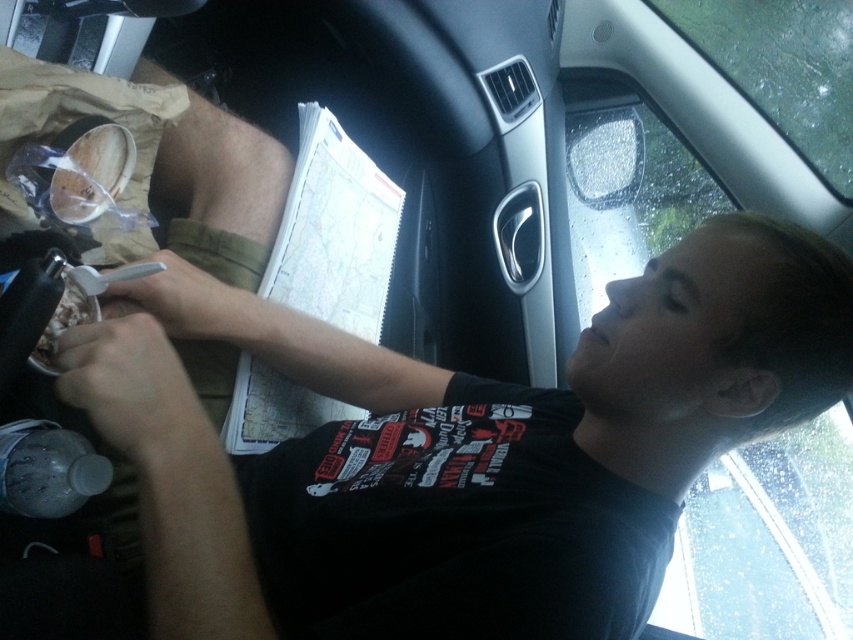
Locate an element on the screen. The image size is (853, 640). transparent glass car window at upper right is located at coordinates (769, 540).

What do you see at coordinates (769, 540) in the screenshot? I see `transparent glass car window at upper right` at bounding box center [769, 540].

Find the location of a particular element. transparent glass car window at upper right is located at coordinates (769, 540).

Where is `transparent glass car window at upper right`? The image size is (853, 640). transparent glass car window at upper right is located at coordinates (769, 540).